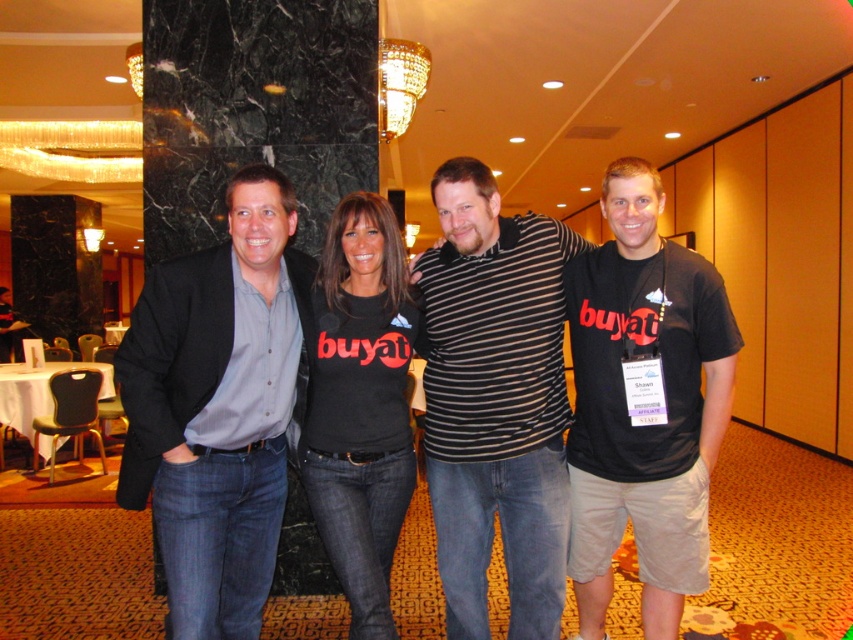
What are the coordinates of `black cotton t-shirt at right` in the screenshot? It's located at (653, 417).

Can you confirm if black cotton t-shirt at right is thinner than black cotton t-shirt at center?

No, black cotton t-shirt at right is not thinner than black cotton t-shirt at center.

Locate an element on the screen. black cotton t-shirt at right is located at coordinates (653, 417).

Looking at this image, is matte gray blazer at center wider than black cotton t-shirt at center?

Indeed, matte gray blazer at center has a greater width compared to black cotton t-shirt at center.

Is matte gray blazer at center above black cotton t-shirt at center?

Incorrect, matte gray blazer at center is not positioned above black cotton t-shirt at center.

Where is `matte gray blazer at center`? Image resolution: width=853 pixels, height=640 pixels. matte gray blazer at center is located at coordinates (218, 406).

Where is `matte gray blazer at center`? The width and height of the screenshot is (853, 640). matte gray blazer at center is located at coordinates (218, 406).

Between matte gray blazer at center and striped cotton shirt at center, which one has more height?

striped cotton shirt at center is taller.

Does point (289, 248) come behind point (479, 291)?

That is True.

Find the location of a particular element. The image size is (853, 640). matte gray blazer at center is located at coordinates (218, 406).